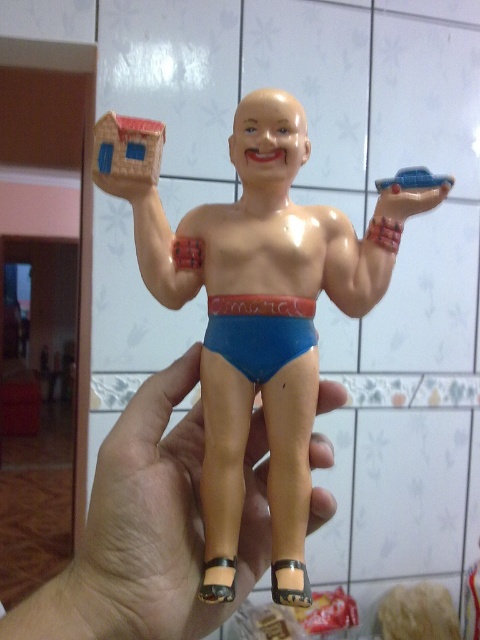
Question: Which point is farther to the camera?

Choices:
 (A) blue matte diaper at center
 (B) blue plastic car at upper right

Answer: (B)

Question: Considering the real-world distances, which object is farthest from the matte plastic hand at lower center?

Choices:
 (A) blue matte diaper at center
 (B) matte plastic toy at center

Answer: (A)

Question: Is matte plastic hand at lower center thinner than blue matte diaper at center?

Choices:
 (A) no
 (B) yes

Answer: (A)

Question: Which point appears closest to the camera in this image?

Choices:
 (A) (304, 323)
 (B) (350, 310)
 (C) (384, 180)
 (D) (176, 371)

Answer: (A)

Question: Can you confirm if matte plastic toy at center is positioned below blue plastic car at upper right?

Choices:
 (A) no
 (B) yes

Answer: (B)

Question: Does matte plastic hand at lower center have a greater width compared to blue matte diaper at center?

Choices:
 (A) yes
 (B) no

Answer: (A)